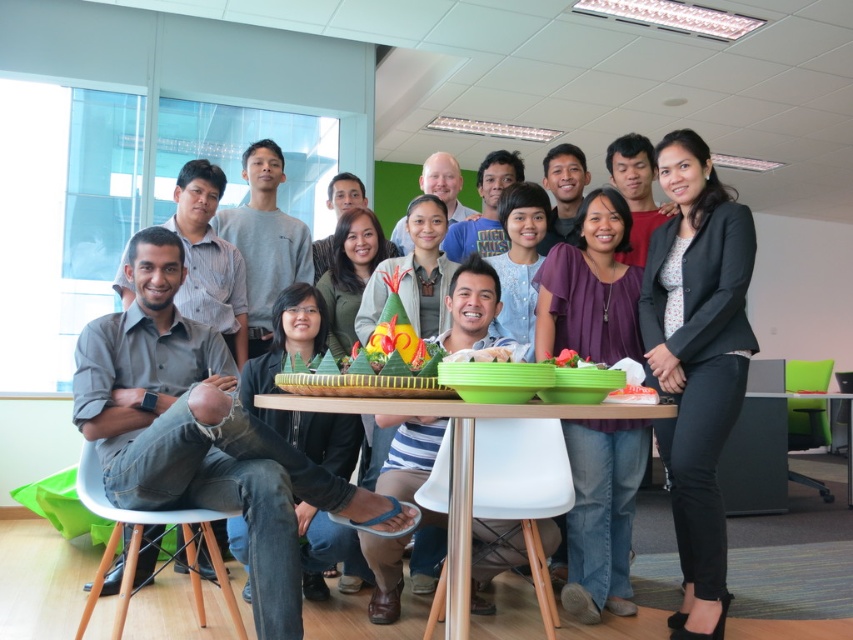
You are standing in the room and want to move from the point at coordinates point (x=599, y=536) to the point at coordinates point (x=683, y=412). Which direction should you move to get closer to the latter point?

Since point (x=599, y=536) is further to the camera than point (x=683, y=412), you should move forward towards the latter point to get closer.

You are a photographer at the event and need to capture a photo of the matte black shirt at center and the black matte blazer at upper right. Based on their heights, which one should you adjust your camera angle to focus on first?

The matte black shirt at center is much taller than the black matte blazer at upper right, so you should focus on the matte black shirt at center first to ensure it is in frame before adjusting for the shorter black matte blazer at upper right.

From the picture: You are standing at the entrance of the room and want to walk directly to the green plastic table at center. According to the 2D coordinates provided, in which direction should you head from your current position?

The green plastic table at center is located at coordinates point (457, 460). Since you are at the entrance, you should head towards the direction of the center point to reach it.